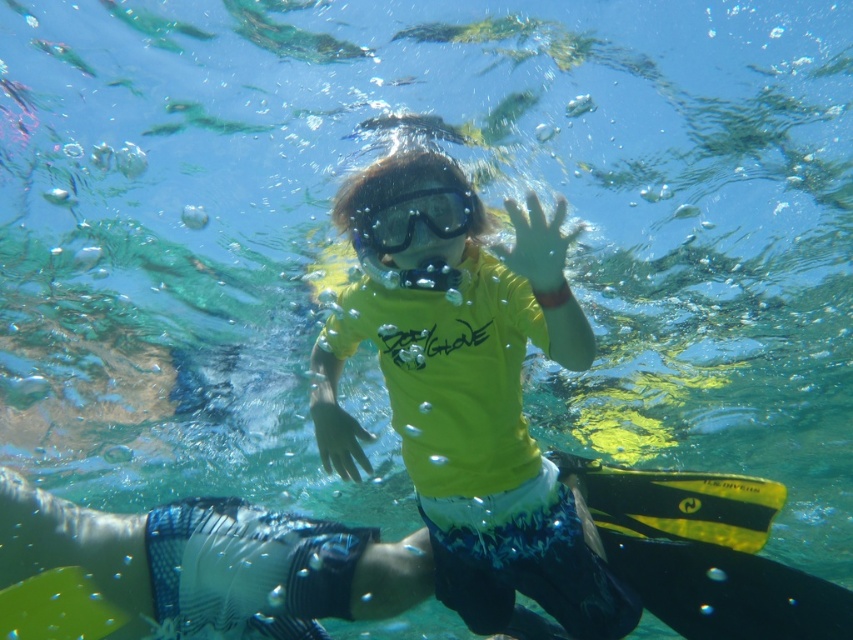
Does yellow matte shirt at center lie behind transparent plastic goggles at center?

That is False.

From the picture: Can you confirm if yellow matte shirt at center is positioned below transparent plastic goggles at center?

Correct, yellow matte shirt at center is located below transparent plastic goggles at center.

Is point (488, 444) positioned before point (459, 196)?

That is False.

Locate an element on the screen. The height and width of the screenshot is (640, 853). yellow matte shirt at center is located at coordinates (468, 392).